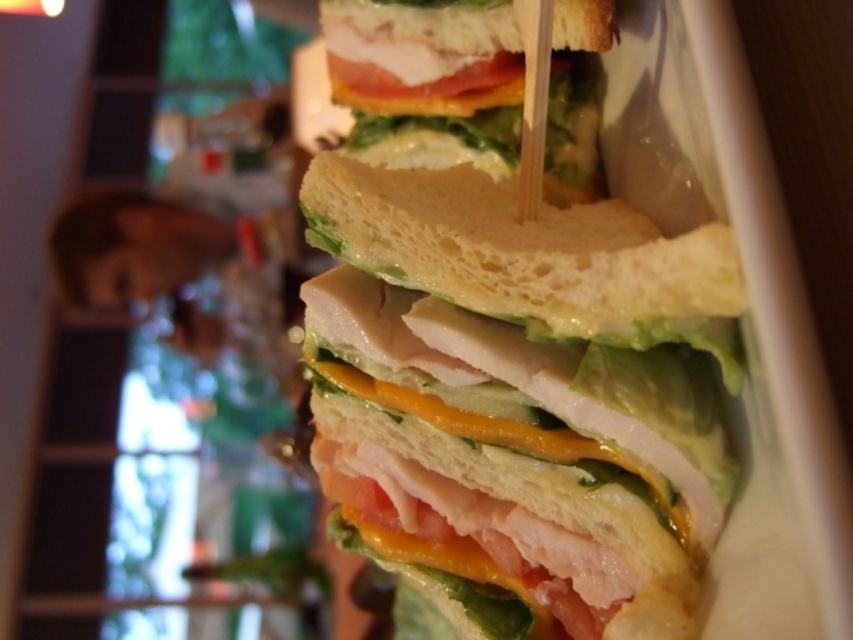
Question: Which object is farther from the camera taking this photo?

Choices:
 (A) white bread sandwich at center
 (B) slightly toasted bread at center

Answer: (B)

Question: Is white bread sandwich at center to the left of slightly toasted bread at center from the viewer's perspective?

Choices:
 (A) yes
 (B) no

Answer: (B)

Question: Can you confirm if white bread sandwich at center is positioned above slightly toasted bread at center?

Choices:
 (A) no
 (B) yes

Answer: (A)

Question: In this image, where is white bread sandwich at center located relative to slightly toasted bread at center?

Choices:
 (A) below
 (B) above

Answer: (A)